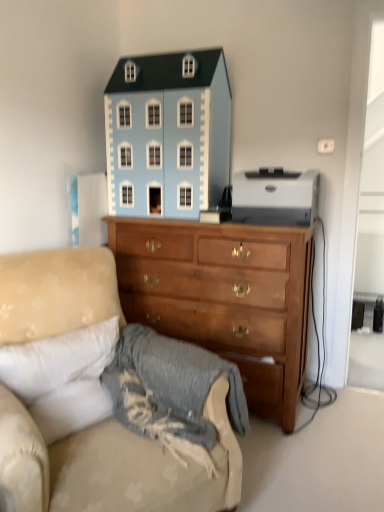
What do you see at coordinates (275, 197) in the screenshot? Image resolution: width=384 pixels, height=512 pixels. I see `white glossy printer at upper right, which is counted as the 2th toy, starting from the left` at bounding box center [275, 197].

Locate an element on the screen. beige fabric couch at lower left is located at coordinates (91, 402).

I want to click on wooden chest of drawers at center, so click(x=224, y=297).

Consider the image. Is light blue painted wood dollhouse at upper center, marked as the 1th toy in a left-to-right arrangement, directly adjacent to wooden chest of drawers at center?

No, light blue painted wood dollhouse at upper center, marked as the 1th toy in a left-to-right arrangement, is not making contact with wooden chest of drawers at center.

From a real-world perspective, is light blue painted wood dollhouse at upper center, marked as the 1th toy in a left-to-right arrangement, positioned under wooden chest of drawers at center based on gravity?

No, from a real-world perspective, light blue painted wood dollhouse at upper center, marked as the 1th toy in a left-to-right arrangement, is not below wooden chest of drawers at center.

Can you tell me how much light blue painted wood dollhouse at upper center, which is the 2th toy in right-to-left order, and wooden chest of drawers at center differ in facing direction?

There is a 1.47-degree angle between the facing directions of light blue painted wood dollhouse at upper center, which is the 2th toy in right-to-left order, and wooden chest of drawers at center.

From the image's perspective, who appears lower, white glossy printer at upper right, which is counted as the 2th toy, starting from the left, or light blue painted wood dollhouse at upper center, marked as the 1th toy in a left-to-right arrangement?

From the image's view, white glossy printer at upper right, which is counted as the 2th toy, starting from the left, is below.

Considering the relative sizes of white glossy printer at upper right, the first toy in the right-to-left sequence, and light blue painted wood dollhouse at upper center, marked as the 1th toy in a left-to-right arrangement, in the image provided, is white glossy printer at upper right, the first toy in the right-to-left sequence, taller than light blue painted wood dollhouse at upper center, marked as the 1th toy in a left-to-right arrangement,?

No, white glossy printer at upper right, the first toy in the right-to-left sequence, is not taller than light blue painted wood dollhouse at upper center, marked as the 1th toy in a left-to-right arrangement.

Can you tell me how much white glossy printer at upper right, which is counted as the 2th toy, starting from the left, and light blue painted wood dollhouse at upper center, which is the 2th toy in right-to-left order, differ in facing direction?

The facing directions of white glossy printer at upper right, which is counted as the 2th toy, starting from the left, and light blue painted wood dollhouse at upper center, which is the 2th toy in right-to-left order, are 0.65 degrees apart.

Looking at this image, considering the sizes of objects white glossy printer at upper right, the first toy in the right-to-left sequence, and light blue painted wood dollhouse at upper center, which is the 2th toy in right-to-left order, in the image provided, who is smaller, white glossy printer at upper right, the first toy in the right-to-left sequence, or light blue painted wood dollhouse at upper center, which is the 2th toy in right-to-left order,?

With smaller size is white glossy printer at upper right, the first toy in the right-to-left sequence.

Can you confirm if wooden chest of drawers at center is bigger than white glossy printer at upper right, which is counted as the 2th toy, starting from the left?

Correct, wooden chest of drawers at center is larger in size than white glossy printer at upper right, which is counted as the 2th toy, starting from the left.

Which is nearer, (164, 315) or (309, 224)?

Point (164, 315).

Is wooden chest of drawers at center taller or shorter than white glossy printer at upper right, the first toy in the right-to-left sequence?

Considering their sizes, wooden chest of drawers at center has more height than white glossy printer at upper right, the first toy in the right-to-left sequence.

Identify the location of the chest of drawers in front of the white glossy printer at upper right, the first toy in the right-to-left sequence. (224, 297).

Is beige fabric couch at lower left facing away from wooden chest of drawers at center?

beige fabric couch at lower left is not turned away from wooden chest of drawers at center.

Is the depth of beige fabric couch at lower left greater than that of wooden chest of drawers at center?

No, it is in front of wooden chest of drawers at center.

Looking at this image, considering the relative sizes of beige fabric couch at lower left and wooden chest of drawers at center in the image provided, is beige fabric couch at lower left taller than wooden chest of drawers at center?

Incorrect, the height of beige fabric couch at lower left is not larger of that of wooden chest of drawers at center.

Is point (76, 377) positioned after point (245, 298)?

No, it is in front of (245, 298).

Considering the positions of point (151, 152) and point (184, 472), is point (151, 152) closer or farther from the camera than point (184, 472)?

Point (151, 152) is farther from the camera than point (184, 472).

Is light blue painted wood dollhouse at upper center, marked as the 1th toy in a left-to-right arrangement, bigger or smaller than beige fabric couch at lower left?

Considering their sizes, light blue painted wood dollhouse at upper center, marked as the 1th toy in a left-to-right arrangement, takes up less space than beige fabric couch at lower left.

The image size is (384, 512). I want to click on toy that is the 2nd object above the beige fabric couch at lower left (from a real-world perspective), so click(168, 134).

Is light blue painted wood dollhouse at upper center, marked as the 1th toy in a left-to-right arrangement, positioned with its back to beige fabric couch at lower left?

That's not correct — light blue painted wood dollhouse at upper center, marked as the 1th toy in a left-to-right arrangement, is not looking away from beige fabric couch at lower left.

Is beige fabric couch at lower left turned away from light blue painted wood dollhouse at upper center, marked as the 1th toy in a left-to-right arrangement?

No, beige fabric couch at lower left is not facing the opposite direction of light blue painted wood dollhouse at upper center, marked as the 1th toy in a left-to-right arrangement.

Considering the relative sizes of beige fabric couch at lower left and light blue painted wood dollhouse at upper center, which is the 2th toy in right-to-left order, in the image provided, is beige fabric couch at lower left taller than light blue painted wood dollhouse at upper center, which is the 2th toy in right-to-left order,?

Yes.

In the image, there is a light blue painted wood dollhouse at upper center, which is the 2th toy in right-to-left order. Where is `studio couch below it (from the image's perspective)`? This screenshot has width=384, height=512. studio couch below it (from the image's perspective) is located at coordinates (91, 402).

Which object is wider, beige fabric couch at lower left or light blue painted wood dollhouse at upper center, marked as the 1th toy in a left-to-right arrangement?

Wider between the two is beige fabric couch at lower left.

Can you confirm if beige fabric couch at lower left is positioned to the left of white glossy printer at upper right, which is counted as the 2th toy, starting from the left?

Yes, beige fabric couch at lower left is to the left of white glossy printer at upper right, which is counted as the 2th toy, starting from the left.

Does beige fabric couch at lower left have a smaller size compared to white glossy printer at upper right, the first toy in the right-to-left sequence?

Incorrect, beige fabric couch at lower left is not smaller in size than white glossy printer at upper right, the first toy in the right-to-left sequence.

From the image's perspective, which one is positioned lower, beige fabric couch at lower left or white glossy printer at upper right, the first toy in the right-to-left sequence?

From the image's view, beige fabric couch at lower left is below.

Do you think beige fabric couch at lower left is within white glossy printer at upper right, the first toy in the right-to-left sequence, or outside of it?

beige fabric couch at lower left is not enclosed by white glossy printer at upper right, the first toy in the right-to-left sequence.

At what (x,y) coordinates should I click in order to perform the action: click on chest of drawers on the right of light blue painted wood dollhouse at upper center, which is the 2th toy in right-to-left order. Please return your answer as a coordinate pair (x, y). The image size is (384, 512). Looking at the image, I should click on (224, 297).

Where is `toy that appears below the light blue painted wood dollhouse at upper center, which is the 2th toy in right-to-left order (from the image's perspective)`? The image size is (384, 512). toy that appears below the light blue painted wood dollhouse at upper center, which is the 2th toy in right-to-left order (from the image's perspective) is located at coordinates (275, 197).

Considering their positions, is wooden chest of drawers at center positioned further to light blue painted wood dollhouse at upper center, marked as the 1th toy in a left-to-right arrangement, than beige fabric couch at lower left?

beige fabric couch at lower left lies further to light blue painted wood dollhouse at upper center, marked as the 1th toy in a left-to-right arrangement, than the other object.

When comparing their distances from white glossy printer at upper right, which is counted as the 2th toy, starting from the left, does wooden chest of drawers at center or beige fabric couch at lower left seem further?

Based on the image, beige fabric couch at lower left appears to be further to white glossy printer at upper right, which is counted as the 2th toy, starting from the left.

From the image, which object appears to be nearer to wooden chest of drawers at center, light blue painted wood dollhouse at upper center, which is the 2th toy in right-to-left order, or white glossy printer at upper right, the first toy in the right-to-left sequence?

Among the two, white glossy printer at upper right, the first toy in the right-to-left sequence, is located nearer to wooden chest of drawers at center.

When comparing their distances from beige fabric couch at lower left, does white glossy printer at upper right, which is counted as the 2th toy, starting from the left, or light blue painted wood dollhouse at upper center, which is the 2th toy in right-to-left order, seem further?

white glossy printer at upper right, which is counted as the 2th toy, starting from the left, lies further to beige fabric couch at lower left than the other object.

Based on their spatial positions, is wooden chest of drawers at center or light blue painted wood dollhouse at upper center, marked as the 1th toy in a left-to-right arrangement, closer to white glossy printer at upper right, the first toy in the right-to-left sequence?

wooden chest of drawers at center is closer to white glossy printer at upper right, the first toy in the right-to-left sequence.

From the image, which object appears to be farther from wooden chest of drawers at center, light blue painted wood dollhouse at upper center, which is the 2th toy in right-to-left order, or beige fabric couch at lower left?

Among the two, beige fabric couch at lower left is located further to wooden chest of drawers at center.

Considering their positions, is beige fabric couch at lower left positioned closer to white glossy printer at upper right, which is counted as the 2th toy, starting from the left, than wooden chest of drawers at center?

wooden chest of drawers at center.

In the scene shown: Based on their spatial positions, is white glossy printer at upper right, which is counted as the 2th toy, starting from the left, or beige fabric couch at lower left further from light blue painted wood dollhouse at upper center, marked as the 1th toy in a left-to-right arrangement?

Based on the image, beige fabric couch at lower left appears to be further to light blue painted wood dollhouse at upper center, marked as the 1th toy in a left-to-right arrangement.

The height and width of the screenshot is (512, 384). Find the location of `chest of drawers between beige fabric couch at lower left and light blue painted wood dollhouse at upper center, which is the 2th toy in right-to-left order, along the z-axis`. chest of drawers between beige fabric couch at lower left and light blue painted wood dollhouse at upper center, which is the 2th toy in right-to-left order, along the z-axis is located at coordinates (224, 297).

This screenshot has height=512, width=384. In order to click on toy located between beige fabric couch at lower left and light blue painted wood dollhouse at upper center, marked as the 1th toy in a left-to-right arrangement, in the depth direction in this screenshot , I will do `click(275, 197)`.

Locate an element on the screen. The height and width of the screenshot is (512, 384). chest of drawers between beige fabric couch at lower left and white glossy printer at upper right, the first toy in the right-to-left sequence, along the z-axis is located at coordinates (224, 297).

This screenshot has height=512, width=384. Find the location of `toy between light blue painted wood dollhouse at upper center, marked as the 1th toy in a left-to-right arrangement, and wooden chest of drawers at center from top to bottom`. toy between light blue painted wood dollhouse at upper center, marked as the 1th toy in a left-to-right arrangement, and wooden chest of drawers at center from top to bottom is located at coordinates (275, 197).